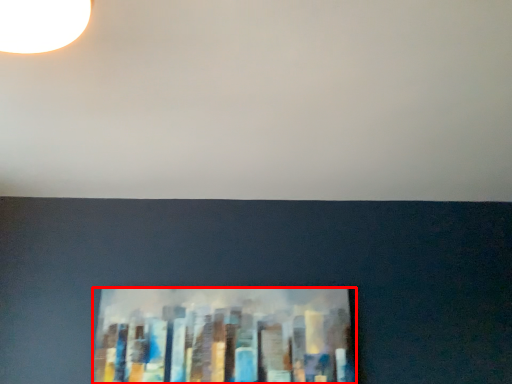
Question: From the image's perspective, where is picture frame (annotated by the red box) located relative to backdrop?

Choices:
 (A) below
 (B) above

Answer: (A)